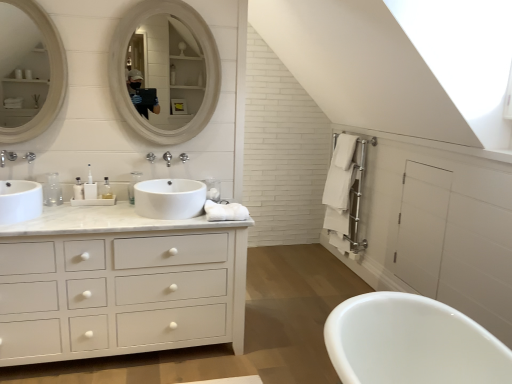
Where is `vacant space to the right of white glossy sink at left, the first sink from the left`? This screenshot has width=512, height=384. vacant space to the right of white glossy sink at left, the first sink from the left is located at coordinates (70, 219).